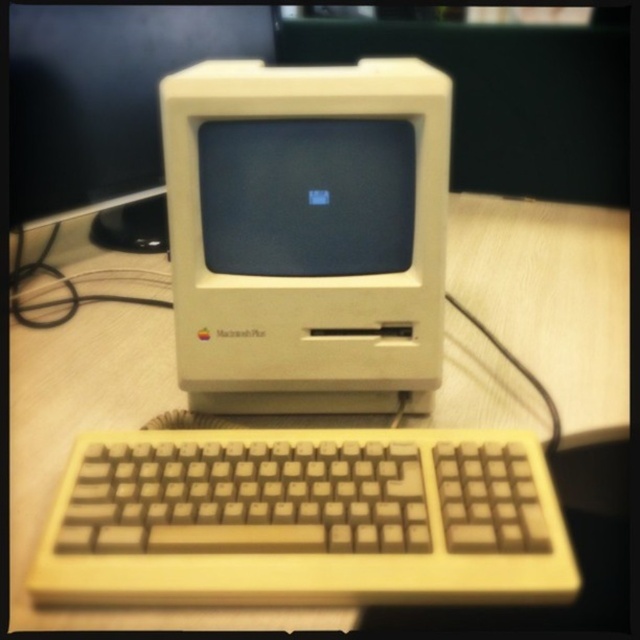
Question: Which point appears farthest from the camera in this image?

Choices:
 (A) (81, 148)
 (B) (588, 298)
 (C) (486, 544)

Answer: (A)

Question: Which object is the closest to the white plastic monitor at center?

Choices:
 (A) matte plastic monitor at center
 (B) beige wood computer desk at center

Answer: (B)

Question: Which point appears closest to the camera in this image?

Choices:
 (A) (42, 140)
 (B) (113, 444)
 (C) (253, 211)

Answer: (B)

Question: Is beige plastic keyboard at lower center thinner than white plastic monitor at center?

Choices:
 (A) no
 (B) yes

Answer: (A)

Question: Can you confirm if white plastic computer at center is positioned below white plastic monitor at center?

Choices:
 (A) no
 (B) yes

Answer: (B)

Question: Does beige plastic keyboard at lower center have a lesser width compared to matte plastic monitor at center?

Choices:
 (A) yes
 (B) no

Answer: (B)